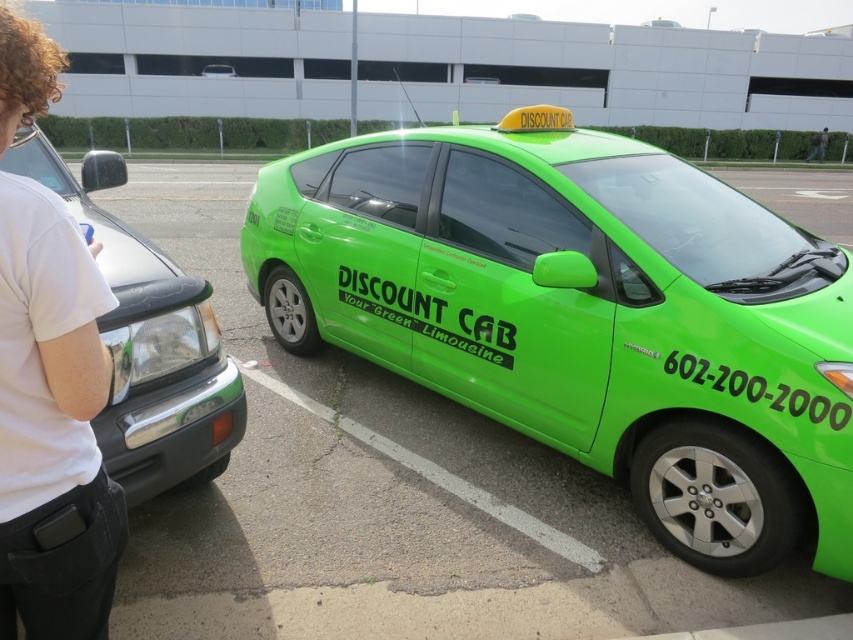
You are a pedestrian standing on the sidewalk and see the green matte taxi at center and the matte black car at left. Which vehicle is positioned higher in the image?

The green matte taxi at center is located above the matte black car at left in the image.

You are a delivery person standing next to the white fabric shirt at left and need to reach the matte black car at left to deliver a package. Can you reach the car without moving the shirt?

The white fabric shirt at left is 37.49 inches away from the matte black car at left, so yes, you can reach the matte black car at left without moving the shirt as the distance is sufficient.

You are standing on the sidewalk and see the white fabric shirt at left and the green matte taxi at upper center. Which object is wider?

The green matte taxi at upper center is wider than the white fabric shirt at left.